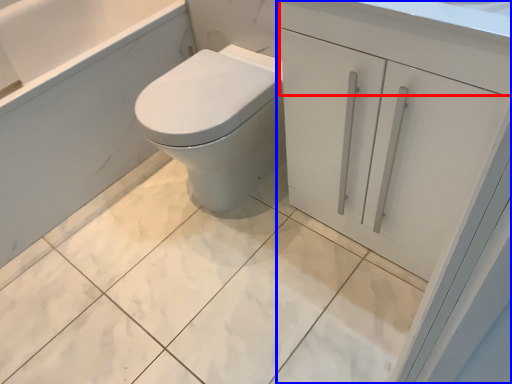
Question: Which object is further to the camera taking this photo, drawer (highlighted by a red box) or bathroom cabinet (highlighted by a blue box)?

Choices:
 (A) drawer
 (B) bathroom cabinet

Answer: (B)